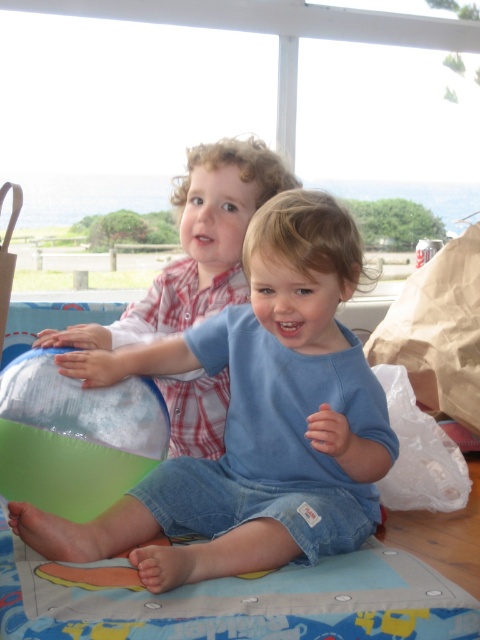
Who is higher up, blue denim shorts at center or blue cotton shirt at center?

blue cotton shirt at center is higher up.

Can you confirm if blue denim shorts at center is positioned above blue cotton shirt at center?

No, blue denim shorts at center is not above blue cotton shirt at center.

Where is `blue denim shorts at center`? The image size is (480, 640). blue denim shorts at center is located at coordinates (252, 419).

Find the location of a particular element. Image resolution: width=480 pixels, height=640 pixels. blue cotton shirt at center is located at coordinates (196, 244).

Between blue cotton shirt at center and green rubber ball at lower left, which one has less height?

With less height is green rubber ball at lower left.

Is point (115, 346) positioned in front of point (72, 472)?

No, it is not.

In order to click on blue cotton shirt at center in this screenshot , I will do `click(196, 244)`.

Based on the photo, between blue denim shorts at center and green rubber ball at lower left, which one is positioned lower?

green rubber ball at lower left is below.

Can you confirm if blue denim shorts at center is positioned below green rubber ball at lower left?

No.

Locate an element on the screen. The height and width of the screenshot is (640, 480). blue denim shorts at center is located at coordinates (252, 419).

The width and height of the screenshot is (480, 640). I want to click on blue denim shorts at center, so click(x=252, y=419).